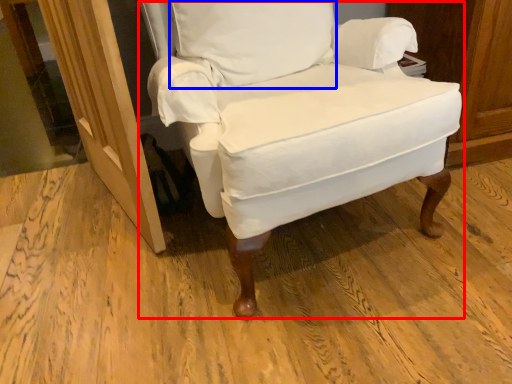
Question: Among these objects, which one is nearest to the camera, chair (highlighted by a red box) or pillow (highlighted by a blue box)?

Choices:
 (A) chair
 (B) pillow

Answer: (A)